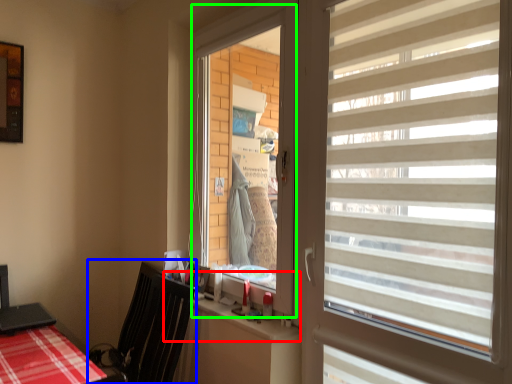
Question: Which is nearer to the counter top (highlighted by a red box)? swivel chair (highlighted by a blue box) or window screen (highlighted by a green box).

Choices:
 (A) swivel chair
 (B) window screen

Answer: (A)